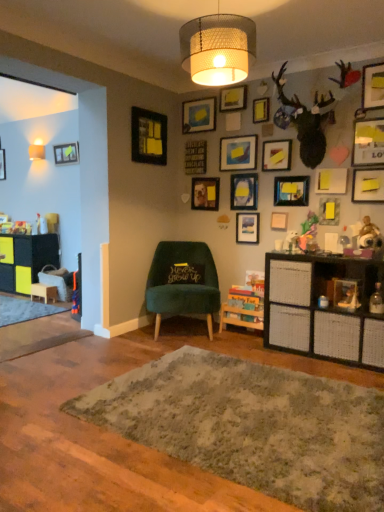
Identify the location of free space in front of velvet green chair at center. Image resolution: width=384 pixels, height=512 pixels. pyautogui.click(x=184, y=347).